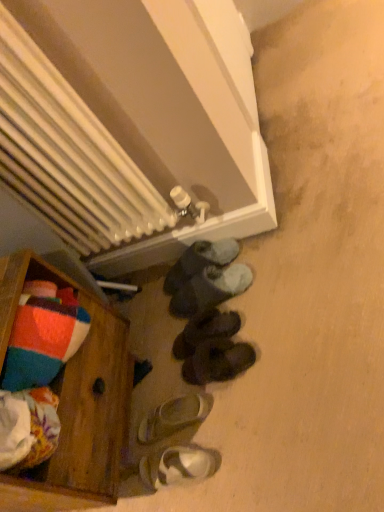
You are a GUI agent. You are given a task and a screenshot of the screen. Output one action in this format:
    pyautogui.click(x=<x>, y=<y>)
    Task: Click on the free space to the back side of black suede shoes at lower center, which is the 4th footwear in top-to-bottom order
    The height and width of the screenshot is (512, 384).
    Given the screenshot: What is the action you would take?
    pyautogui.click(x=167, y=342)